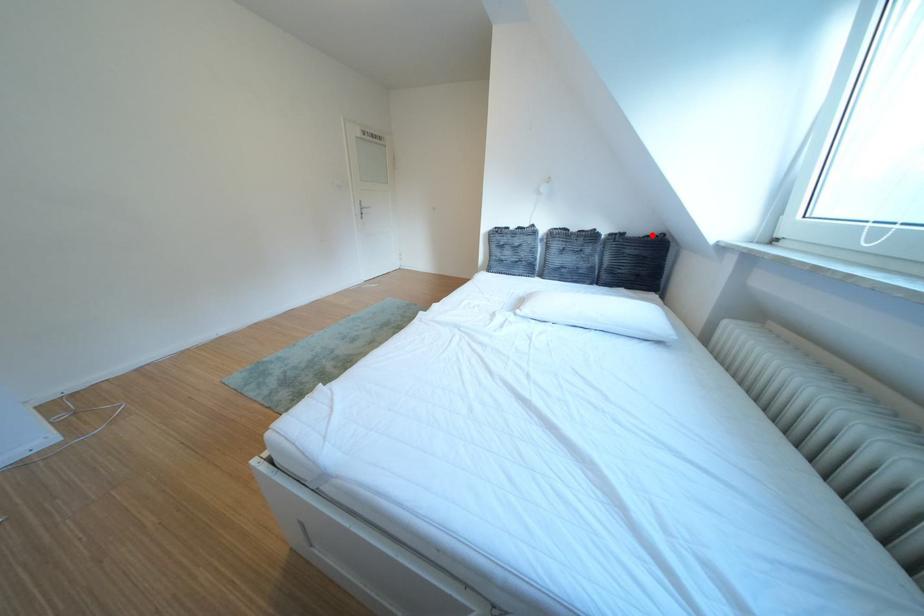
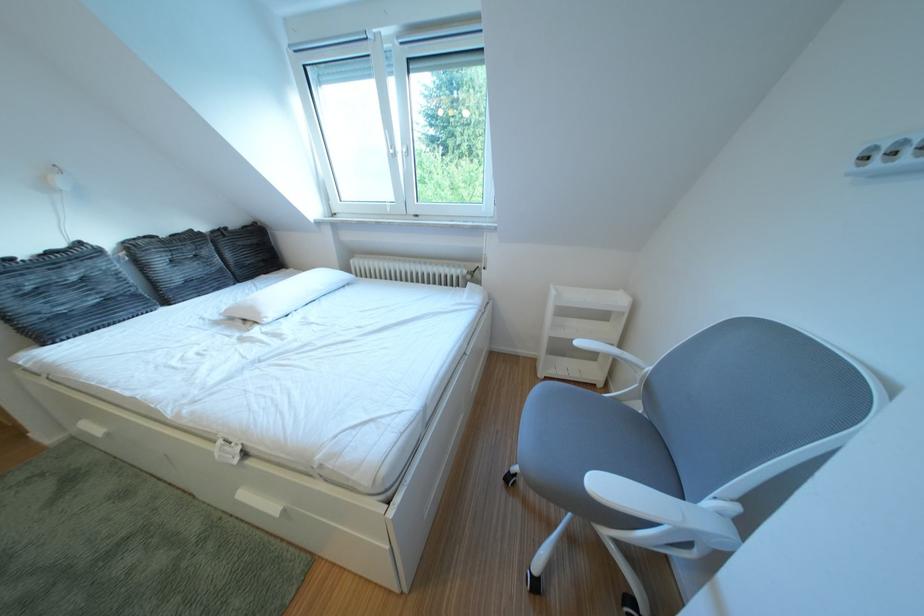
The point at the highlighted location is marked in the first image. Where is the corresponding point in the second image?

(247, 228)